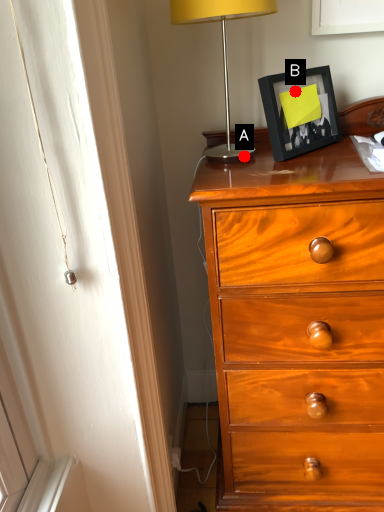
Question: Two points are circled on the image, labeled by A and B beside each circle. Which point is farther from the camera taking this photo?

Choices:
 (A) A is further
 (B) B is further

Answer: (A)